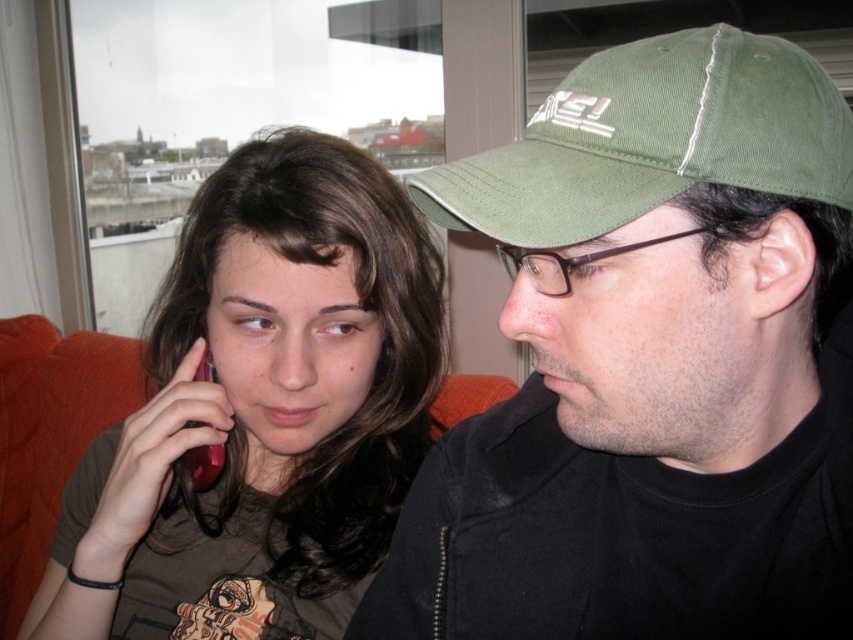
Can you confirm if green fabric cap at upper right is positioned above green fabric baseball cap at upper right?

Incorrect, green fabric cap at upper right is not positioned above green fabric baseball cap at upper right.

Is point (641, 252) positioned in front of point (556, 156)?

Yes, point (641, 252) is closer to viewer.

Who is more forward, (782, 588) or (525, 168)?

Positioned in front is point (525, 168).

The image size is (853, 640). In order to click on green fabric cap at upper right in this screenshot , I will do `click(646, 368)`.

Is green fabric baseball cap at upper right shorter than skinny green cap at right?

In fact, green fabric baseball cap at upper right may be taller than skinny green cap at right.

Can you confirm if green fabric baseball cap at upper right is positioned to the right of skinny green cap at right?

No, green fabric baseball cap at upper right is not to the right of skinny green cap at right.

Is point (554, 234) farther from viewer compared to point (776, 218)?

No, (554, 234) is closer to viewer.

Locate an element on the screen. The image size is (853, 640). green fabric baseball cap at upper right is located at coordinates point(653,140).

Which is below, green fabric baseball cap at upper right or matte pink phone at left?

Positioned lower is matte pink phone at left.

Is green fabric baseball cap at upper right smaller than matte pink phone at left?

No.

Find the location of a particular element. green fabric baseball cap at upper right is located at coordinates (653, 140).